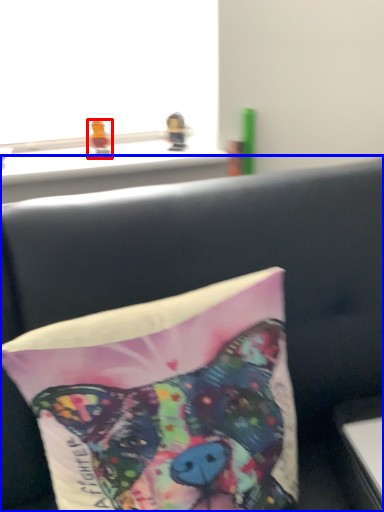
Question: Which of the following is the closest to the observer, toy (highlighted by a red box) or furniture (highlighted by a blue box)?

Choices:
 (A) toy
 (B) furniture

Answer: (B)